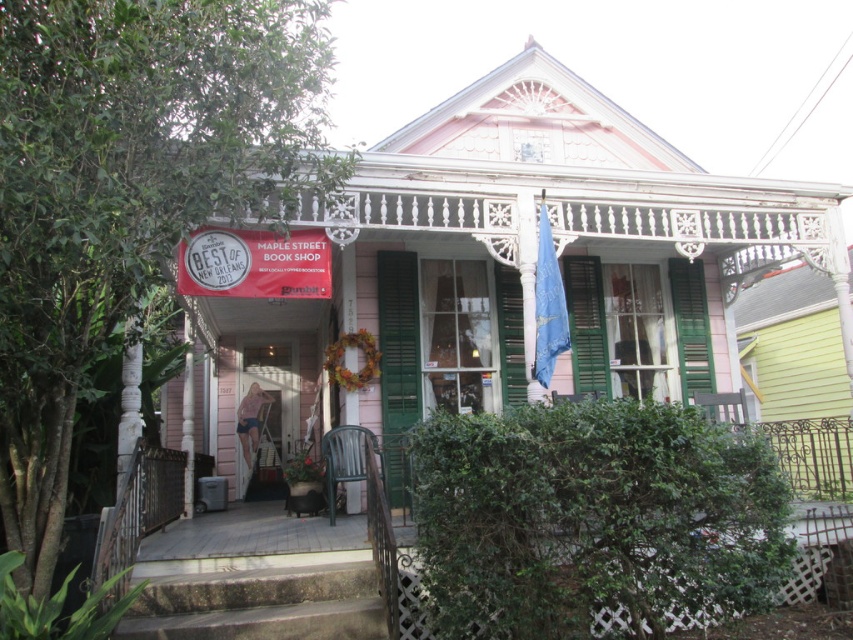
Question: Is green plastic chair at lower center positioned behind green matte shutter at center?

Choices:
 (A) no
 (B) yes

Answer: (A)

Question: Which point is closer to the camera?

Choices:
 (A) (418, 330)
 (B) (161, 573)

Answer: (B)

Question: Does green plastic chair at lower center have a greater width compared to green matte shutter at center?

Choices:
 (A) no
 (B) yes

Answer: (B)

Question: Among these objects, which one is farthest from the camera?

Choices:
 (A) green plastic chair at lower center
 (B) green matte shutter at center

Answer: (B)

Question: Can you confirm if green plastic chair at lower center is bigger than green matte shutter at center?

Choices:
 (A) yes
 (B) no

Answer: (A)